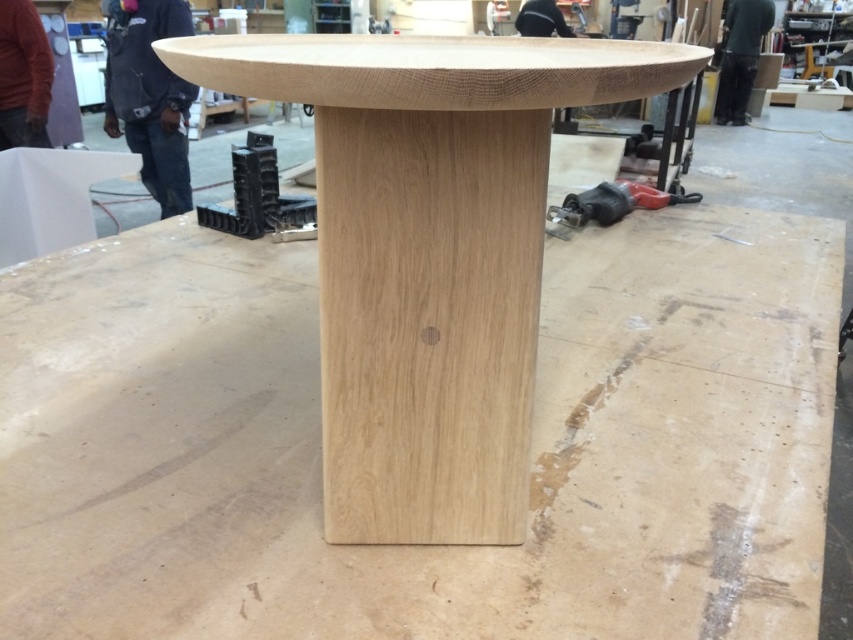
Consider the image. How distant is natural wood table at center from red plastic drill at lower right?

natural wood table at center is 7.11 feet away from red plastic drill at lower right.

Does point (514, 161) lie behind point (564, 221)?

No.

Which is behind, point (320, 150) or point (552, 220)?

Positioned behind is point (552, 220).

You are a GUI agent. You are given a task and a screenshot of the screen. Output one action in this format:
    pyautogui.click(x=<x>, y=<y>)
    Task: Click on the natural wood table at center
    The height and width of the screenshot is (640, 853).
    Given the screenshot: What is the action you would take?
    pyautogui.click(x=428, y=253)